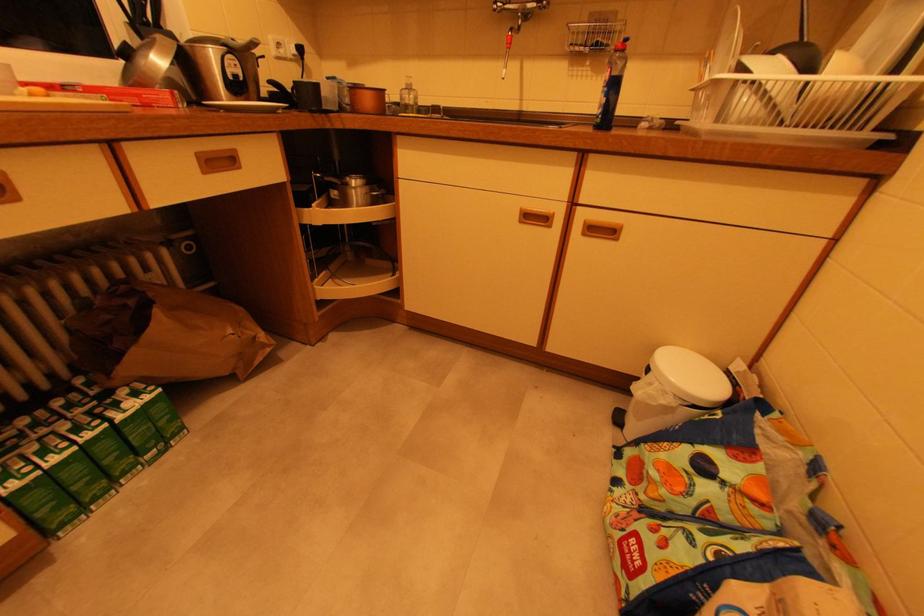
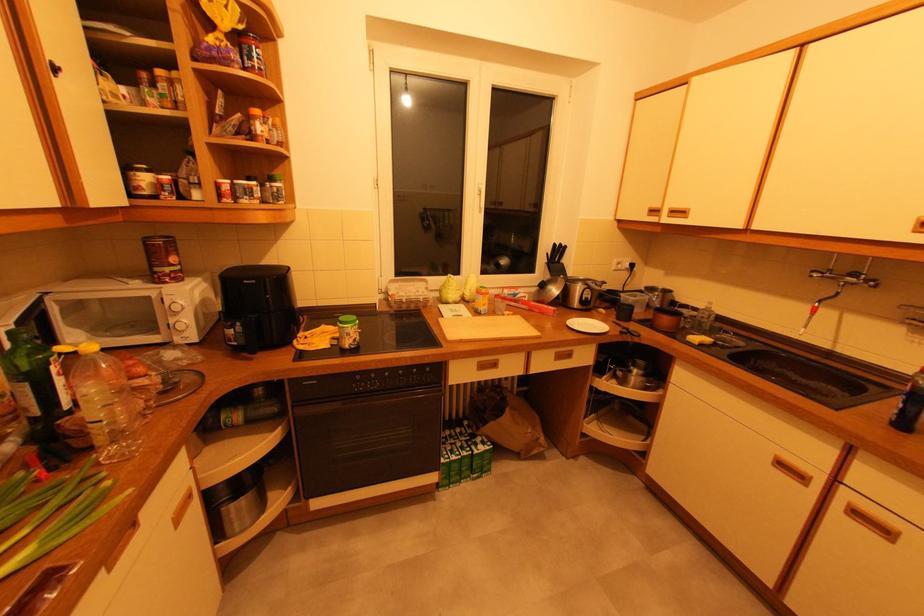
In the second image, find the point that corresponds to (x=614, y=233) in the first image.

(889, 532)